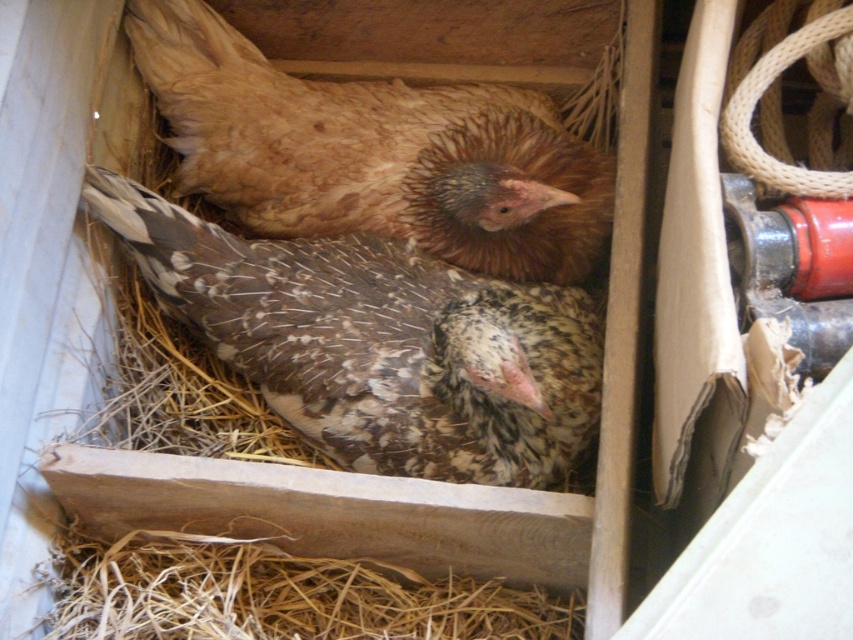
Who is lower down, speckled feathered chicken at center or brown speckled chicken at upper center?

speckled feathered chicken at center is lower down.

Can you confirm if speckled feathered chicken at center is positioned below brown speckled chicken at upper center?

Yes, speckled feathered chicken at center is below brown speckled chicken at upper center.

Identify the location of speckled feathered chicken at center. The height and width of the screenshot is (640, 853). (376, 342).